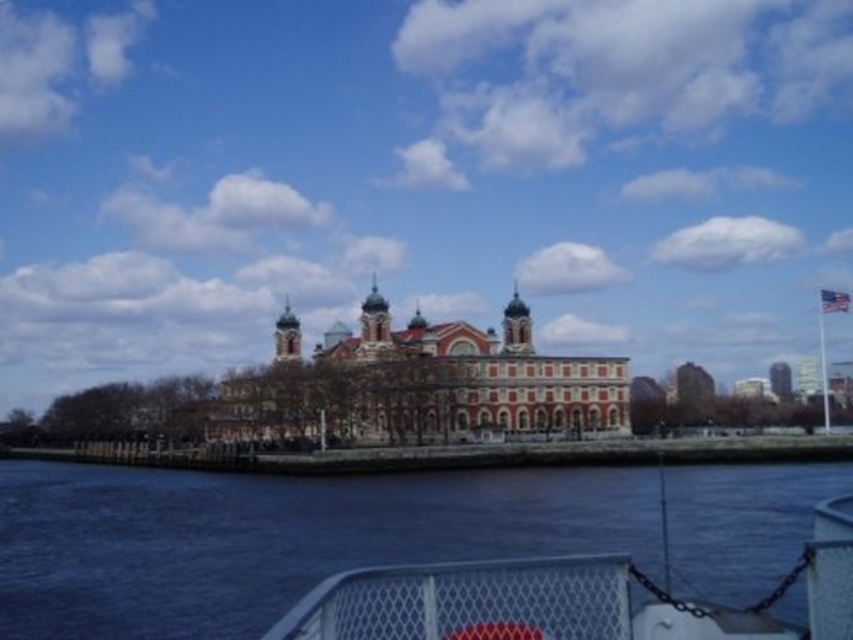
Does dark blue water at lower center appear on the right side of red brick building at center?

Incorrect, dark blue water at lower center is not on the right side of red brick building at center.

Is dark blue water at lower center taller than red brick building at center?

In fact, dark blue water at lower center may be shorter than red brick building at center.

Which is in front, point (773, 545) or point (234, 419)?

Point (773, 545) is more forward.

This screenshot has height=640, width=853. Find the location of `dark blue water at lower center`. dark blue water at lower center is located at coordinates (276, 538).